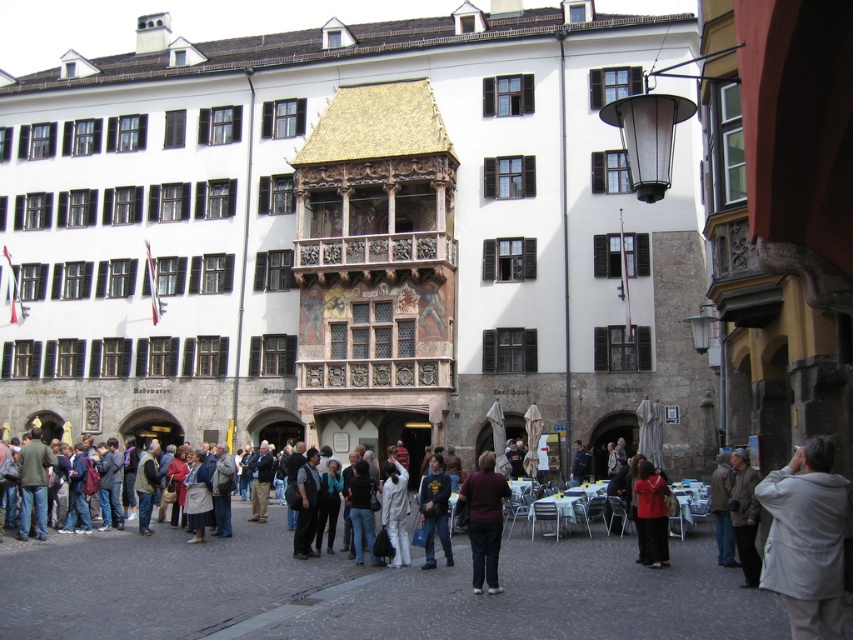
Question: Which of the following is the closest to the observer?

Choices:
 (A) light gray fabric jacket at lower right
 (B) dark blue cotton shirt at center
 (C) dark brown fabric pants at center

Answer: (A)

Question: Among these points, which one is farthest from the camera?

Choices:
 (A) (393, 496)
 (B) (730, 492)
 (C) (502, 522)

Answer: (A)

Question: Does dark brown fabric pants at center have a greater width compared to brown leather jacket at lower right?

Choices:
 (A) no
 (B) yes

Answer: (B)

Question: Is dark brown fabric pants at center wider than white matte jacket at center?

Choices:
 (A) yes
 (B) no

Answer: (A)

Question: Is light gray fabric jacket at lower right closer to camera compared to dark brown fabric pants at center?

Choices:
 (A) no
 (B) yes

Answer: (B)

Question: Which object appears closest to the camera in this image?

Choices:
 (A) dark brown fabric pants at center
 (B) white matte jacket at center
 (C) brown leather jacket at lower right

Answer: (A)